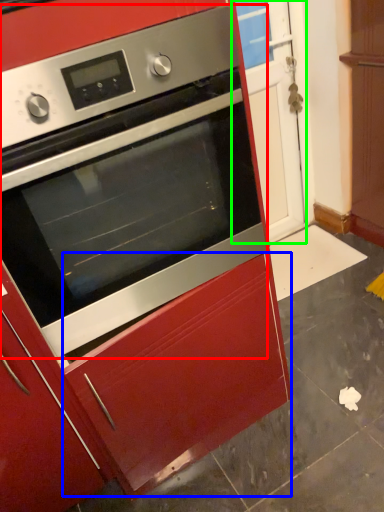
Question: Based on their relative distances, which object is farther from oven (highlighted by a red box)? Choose from drawer (highlighted by a blue box) and glass door (highlighted by a green box).

Choices:
 (A) drawer
 (B) glass door

Answer: (B)